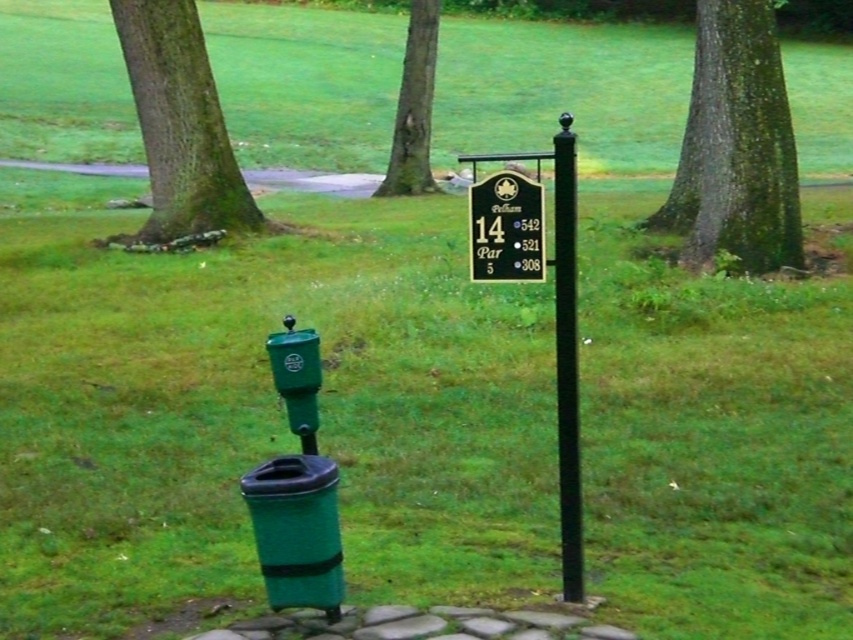
You are a golfer who wants to know which tree has a wider trunk between the green mossy tree at upper left and the green bark tree at center. Which one should you choose?

The green mossy tree at upper left has a larger width than the green bark tree at center, so you should choose the green mossy tree at upper left.

You are a golfer standing at the tee box and see the green mossy tree at upper left and the black polished pole at center. Which object is taller?

The green mossy tree at upper left is taller than the black polished pole at center.

You are a golfer trying to find the 14th hole. You see the green mossy tree at upper left and the black polished pole at center. Which object is closer to the left side of the image?

The green mossy tree at upper left is closer to the left side of the image than the black polished pole at center.